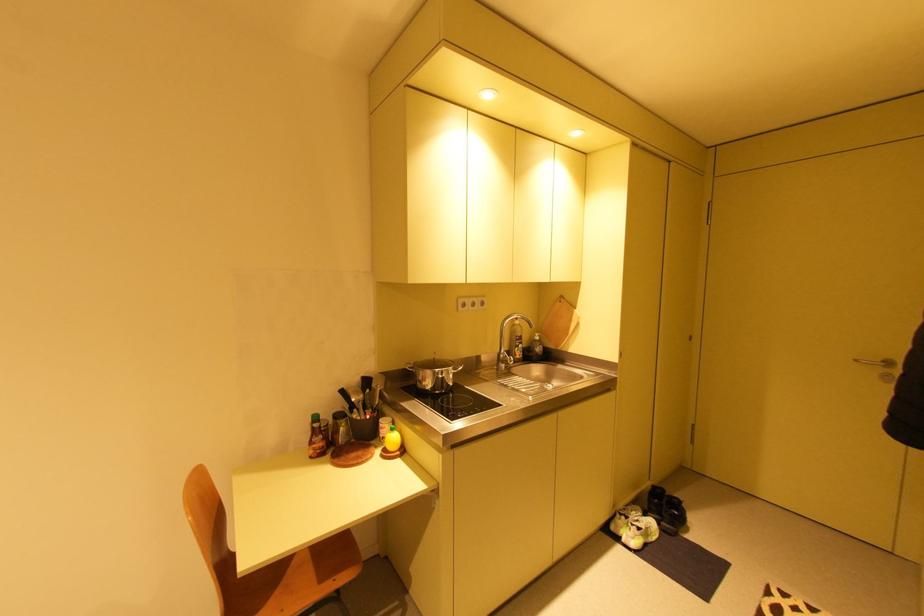
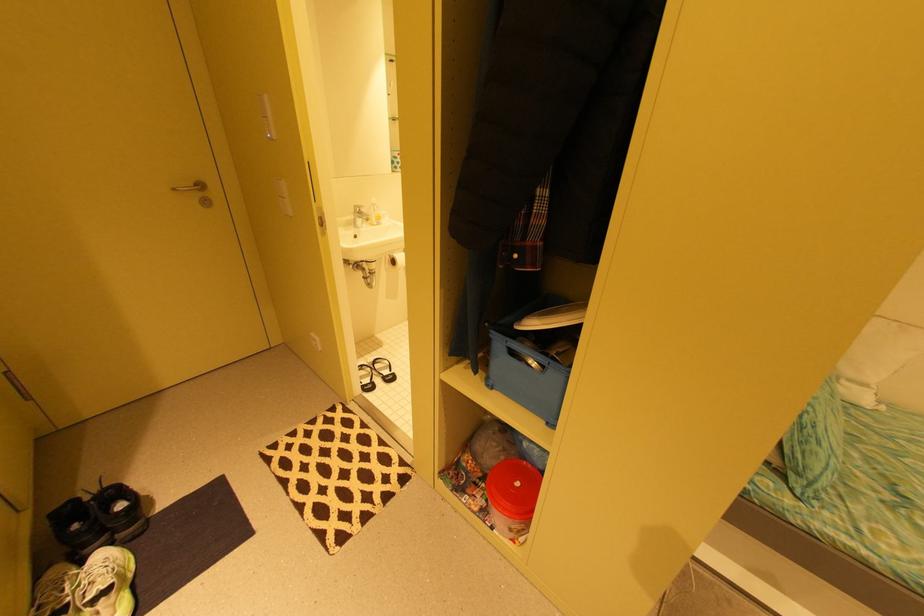
In the second image, find the point that corresponds to point 861,361 in the first image.

(179, 190)